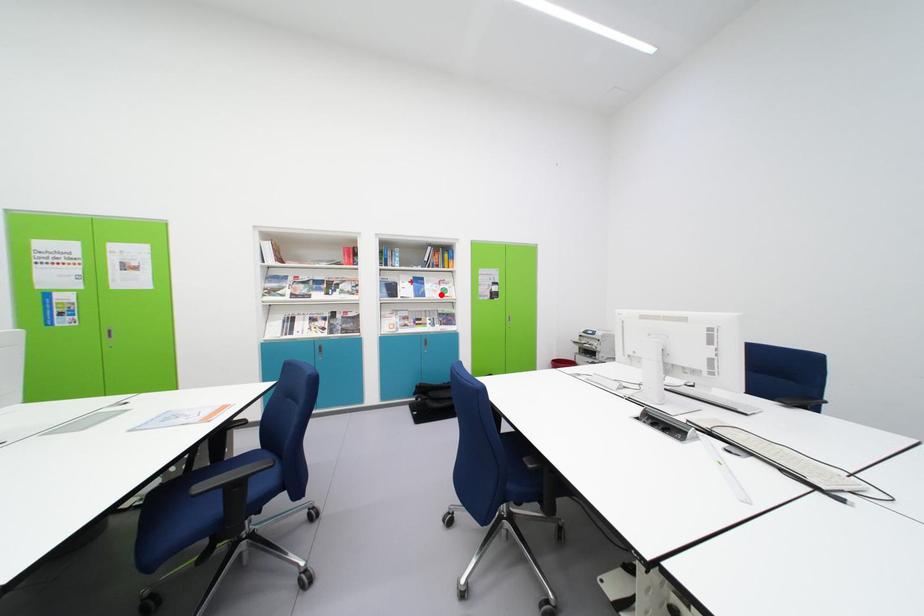
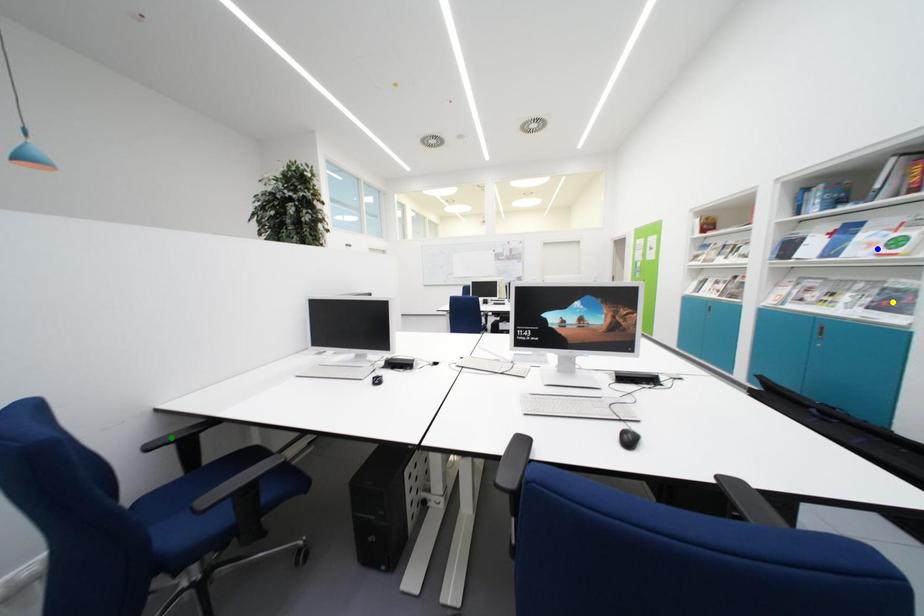
Question: I am providing you with two images of the same scene from different viewpoints. A red point is marked on the first image. You are given multiple points on the second image. In image 2, which mark is for the same physical point as the one in image 1?

Choices:
 (A) blue point
 (B) green point
 (C) yellow point

Answer: (A)